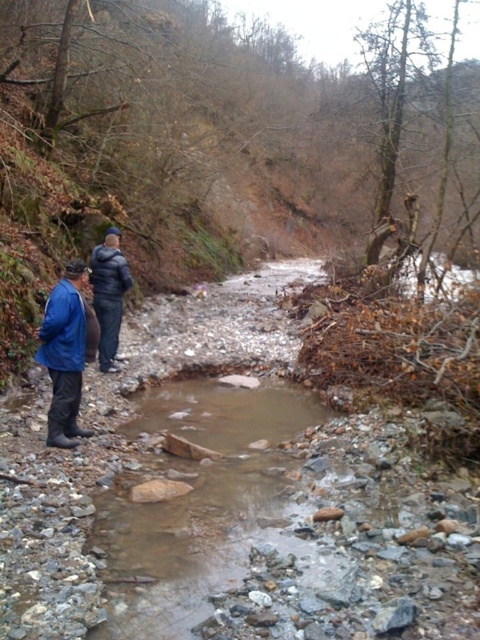
Question: Does blue fabric jacket at lower left have a greater width compared to dark blue down jacket at center?

Choices:
 (A) no
 (B) yes

Answer: (A)

Question: Which of the following is the closest to the observer?

Choices:
 (A) blue fabric jacket at lower left
 (B) dark blue down jacket at center

Answer: (A)

Question: Which object is closer to the camera taking this photo?

Choices:
 (A) blue fabric jacket at lower left
 (B) dark blue down jacket at center

Answer: (A)

Question: Is blue fabric jacket at lower left further to camera compared to dark blue down jacket at center?

Choices:
 (A) no
 (B) yes

Answer: (A)

Question: Is blue fabric jacket at lower left to the right of dark blue down jacket at center from the viewer's perspective?

Choices:
 (A) no
 (B) yes

Answer: (B)